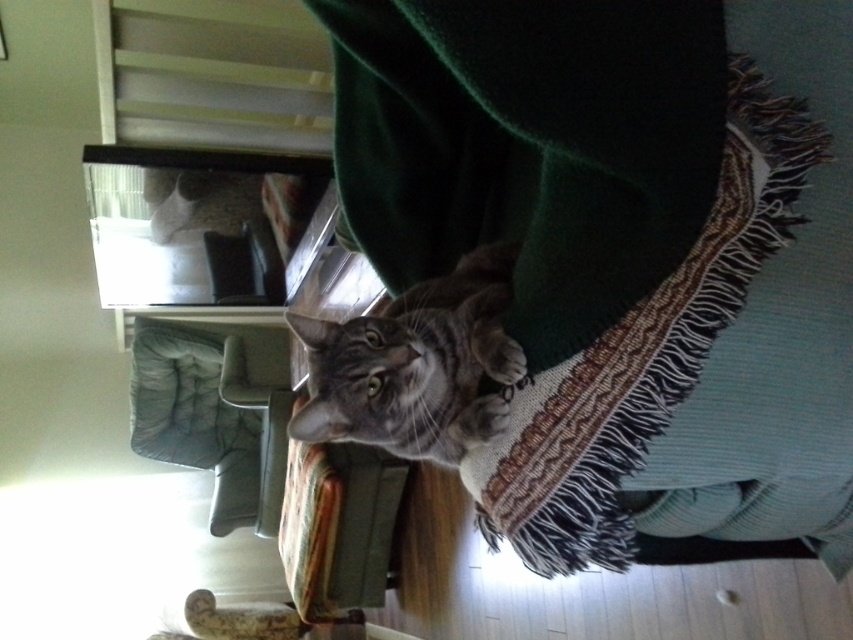
Is point (469, 481) positioned after point (189, 408)?

No, it is in front of (189, 408).

Does velvet green blanket at center have a lesser height compared to matte gray chair at lower left?

Yes, velvet green blanket at center is shorter than matte gray chair at lower left.

You are a GUI agent. You are given a task and a screenshot of the screen. Output one action in this format:
    pyautogui.click(x=<x>, y=<y>)
    Task: Click on the velvet green blanket at center
    This screenshot has width=853, height=640.
    Given the screenshot: What is the action you would take?
    pyautogui.click(x=630, y=253)

Find the location of `velvet green blanket at center`. velvet green blanket at center is located at coordinates (630, 253).

Measure the distance from gray tabby cat at center to matte gray chair at lower left.

gray tabby cat at center and matte gray chair at lower left are 2.81 meters apart from each other.

Locate an element on the screen. gray tabby cat at center is located at coordinates tap(415, 365).

This screenshot has height=640, width=853. In order to click on gray tabby cat at center in this screenshot , I will do `click(415, 365)`.

Who is lower down, velvet green blanket at center or gray tabby cat at center?

velvet green blanket at center is below.

Does velvet green blanket at center have a smaller size compared to gray tabby cat at center?

No, velvet green blanket at center is not smaller than gray tabby cat at center.

Find the location of a particular element. The width and height of the screenshot is (853, 640). velvet green blanket at center is located at coordinates (630, 253).

Where is `velvet green blanket at center`? This screenshot has width=853, height=640. velvet green blanket at center is located at coordinates (630, 253).